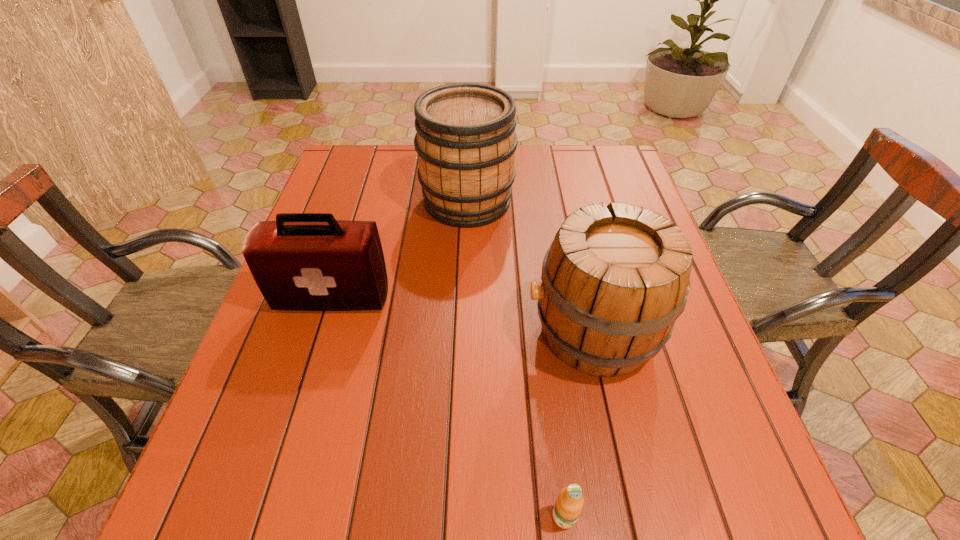
At what (x,y) coordinates should I click in order to perform the action: click on empty location between the orange juice and the leftmost object. Please return your answer as a coordinate pair (x, y). This screenshot has height=540, width=960. Looking at the image, I should click on (448, 407).

At what (x,y) coordinates should I click in order to perform the action: click on object that stands as the second closest to the orange juice. Please return your answer as a coordinate pair (x, y). Looking at the image, I should click on (302, 261).

Locate an element on the screen. The width and height of the screenshot is (960, 540). object that is the closest to the right cider is located at coordinates (466, 141).